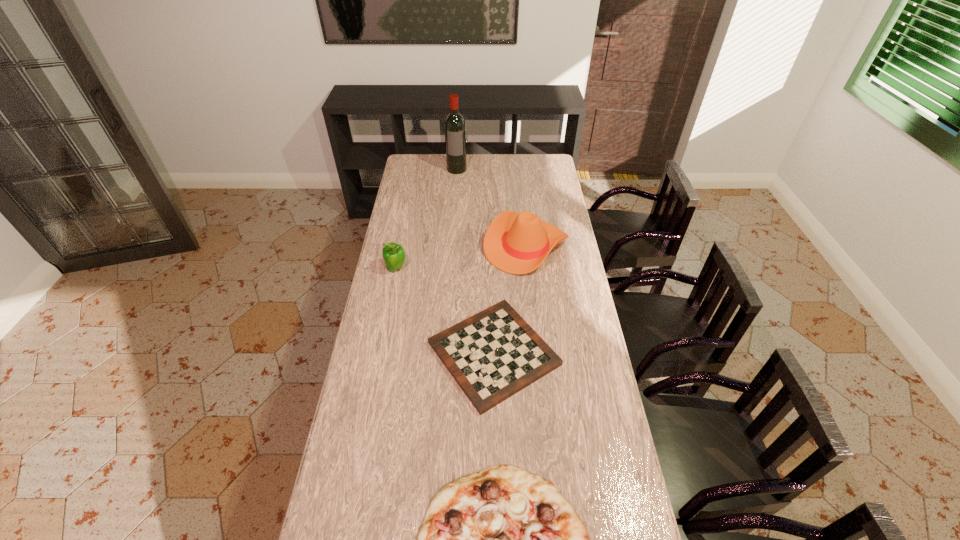
At what (x,y) coordinates should I click in order to perform the action: click on the farthest object. Please return your answer as a coordinate pair (x, y). Looking at the image, I should click on (455, 130).

In order to click on the tallest object in this screenshot , I will do `click(455, 130)`.

I want to click on cowboy hat, so click(517, 243).

Where is `the leftmost object`? Image resolution: width=960 pixels, height=540 pixels. the leftmost object is located at coordinates (393, 254).

Identify the location of chessboard. (492, 355).

I want to click on the fourth tallest object, so click(492, 355).

Where is `vacant point located 0.390m on the label of the tallest object`? vacant point located 0.390m on the label of the tallest object is located at coordinates (453, 218).

This screenshot has height=540, width=960. In order to click on vacant area situated on the front of the cowboy hat in this screenshot , I will do `click(533, 305)`.

Find the location of a particular element. The height and width of the screenshot is (540, 960). blank space located on the right of the leftmost object is located at coordinates (438, 268).

Locate an element on the screen. This screenshot has height=540, width=960. free space located on the front of the fourth tallest object is located at coordinates [497, 494].